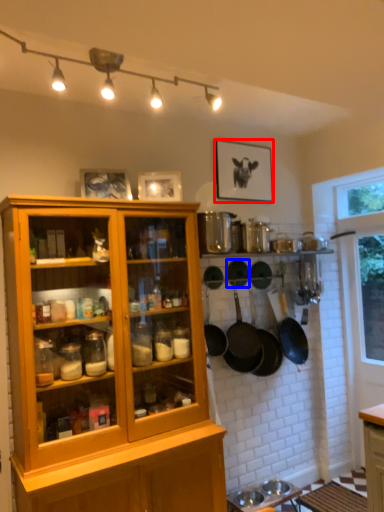
Question: Which object appears closest to the camera in this image, picture frame (highlighted by a red box) or frying pan (highlighted by a blue box)?

Choices:
 (A) picture frame
 (B) frying pan

Answer: (B)